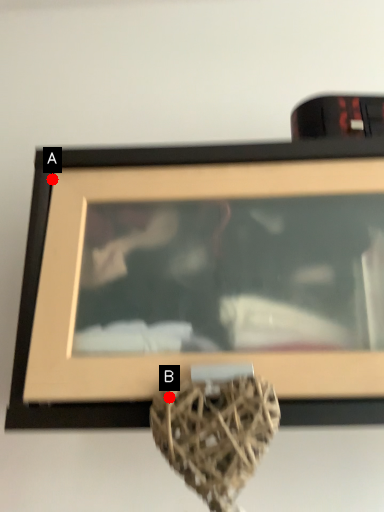
Question: Two points are circled on the image, labeled by A and B beside each circle. Which of the following is the farthest from the observer?

Choices:
 (A) A is further
 (B) B is further

Answer: (A)